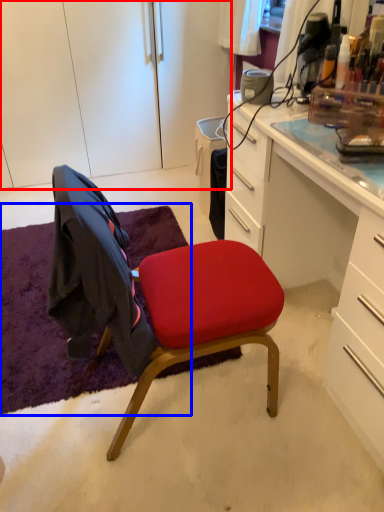
Question: Which of the following is the farthest to the observer, cabinetry (highlighted by a red box) or mat (highlighted by a blue box)?

Choices:
 (A) cabinetry
 (B) mat

Answer: (A)